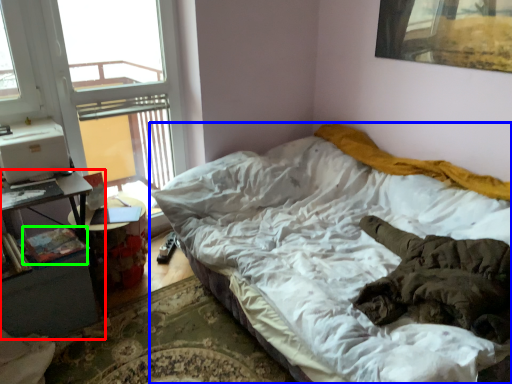
Question: Which object is positioned farthest from nightstand (highlighted by a red box)? Select from bed (highlighted by a blue box) and book (highlighted by a green box).

Choices:
 (A) bed
 (B) book

Answer: (A)